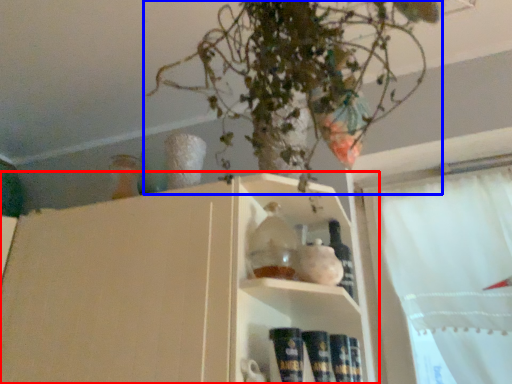
Question: Which object appears closest to the camera in this image, shelf (highlighted by a red box) or houseplant (highlighted by a blue box)?

Choices:
 (A) shelf
 (B) houseplant

Answer: (A)